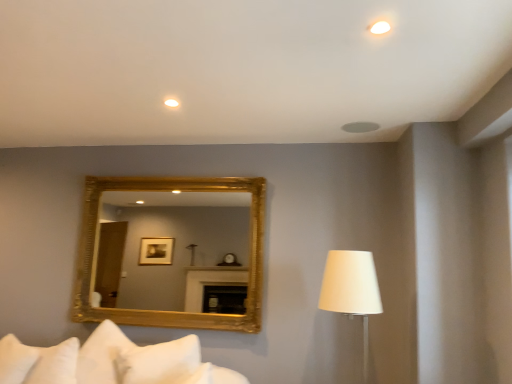
Locate an element on the screen. This screenshot has height=384, width=512. free spot behind white matte ceiling light at upper center, the first lighting from the front is located at coordinates (367, 43).